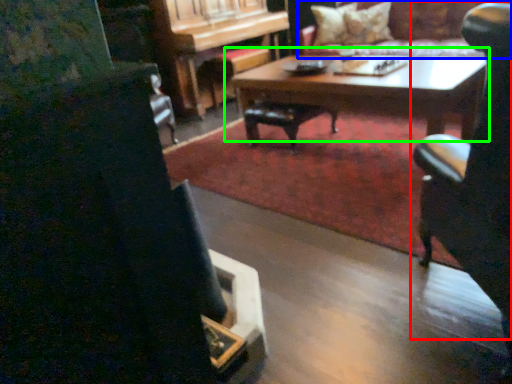
Question: Which object is the farthest from chair (highlighted by a red box)? Choose among these: couch (highlighted by a blue box) or coffee table (highlighted by a green box).

Choices:
 (A) couch
 (B) coffee table

Answer: (A)